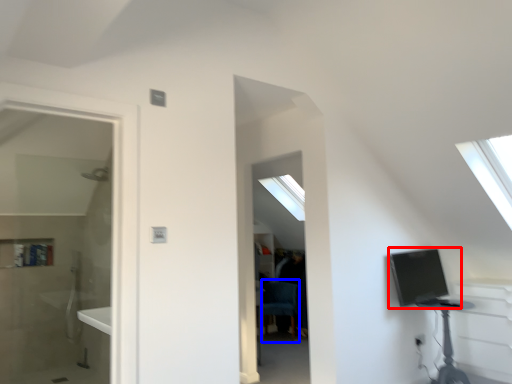
Question: Which of the following is the farthest to the observer, computer (highlighted by a red box) or swivel chair (highlighted by a blue box)?

Choices:
 (A) computer
 (B) swivel chair

Answer: (B)